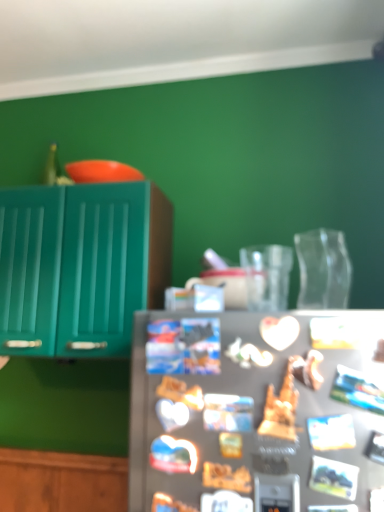
Question: Considering the relative sizes of satin silver refrigerator at center and satin silver fridge at center in the image provided, is satin silver refrigerator at center shorter than satin silver fridge at center?

Choices:
 (A) no
 (B) yes

Answer: (B)

Question: Does satin silver refrigerator at center have a lesser width compared to satin silver fridge at center?

Choices:
 (A) yes
 (B) no

Answer: (A)

Question: Is satin silver refrigerator at center looking in the opposite direction of satin silver fridge at center?

Choices:
 (A) yes
 (B) no

Answer: (A)

Question: Is satin silver refrigerator at center not inside satin silver fridge at center?

Choices:
 (A) no
 (B) yes

Answer: (A)

Question: Can you confirm if satin silver refrigerator at center is positioned to the left of satin silver fridge at center?

Choices:
 (A) no
 (B) yes

Answer: (A)

Question: Does satin silver refrigerator at center turn towards satin silver fridge at center?

Choices:
 (A) no
 (B) yes

Answer: (B)

Question: Does teal glossy cabinet at left have a larger size compared to satin silver refrigerator at center?

Choices:
 (A) yes
 (B) no

Answer: (A)

Question: Is teal glossy cabinet at left outside of satin silver refrigerator at center?

Choices:
 (A) yes
 (B) no

Answer: (A)

Question: From a real-world perspective, does teal glossy cabinet at left sit lower than satin silver refrigerator at center?

Choices:
 (A) yes
 (B) no

Answer: (B)

Question: Is teal glossy cabinet at left looking in the opposite direction of satin silver refrigerator at center?

Choices:
 (A) no
 (B) yes

Answer: (A)

Question: Could satin silver refrigerator at center be considered to be inside teal glossy cabinet at left?

Choices:
 (A) no
 (B) yes

Answer: (A)

Question: Is teal glossy cabinet at left at the right side of satin silver refrigerator at center?

Choices:
 (A) no
 (B) yes

Answer: (A)

Question: Can you confirm if satin silver fridge at center is taller than satin silver refrigerator at center?

Choices:
 (A) yes
 (B) no

Answer: (A)